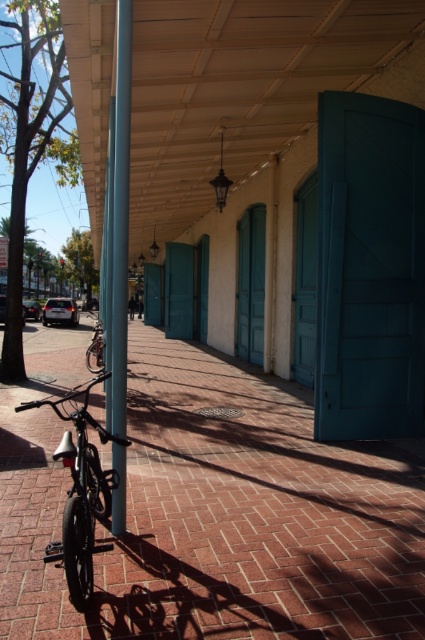
Is brick pavement at center to the right of shiny silver bicycle at center from the viewer's perspective?

Correct, you'll find brick pavement at center to the right of shiny silver bicycle at center.

Is brick pavement at center wider than shiny silver bicycle at center?

Correct, the width of brick pavement at center exceeds that of shiny silver bicycle at center.

Identify the location of brick pavement at center. This screenshot has height=640, width=425. (212, 508).

Can you confirm if metallic silver pole at center is positioned above shiny black bicycle at center?

Indeed, metallic silver pole at center is positioned over shiny black bicycle at center.

Is metallic silver pole at center wider than shiny black bicycle at center?

In fact, metallic silver pole at center might be narrower than shiny black bicycle at center.

This screenshot has width=425, height=640. Describe the element at coordinates (119, 224) in the screenshot. I see `metallic silver pole at center` at that location.

Where is `metallic silver pole at center`? This screenshot has width=425, height=640. metallic silver pole at center is located at coordinates (119, 224).

How much distance is there between shiny black bicycle at center and shiny silver bicycle at center?

A distance of 11.38 meters exists between shiny black bicycle at center and shiny silver bicycle at center.

Can you confirm if shiny black bicycle at center is wider than shiny silver bicycle at center?

No.

Is point (82, 499) positioned after point (96, 355)?

No, it is not.

At what (x,y) coordinates should I click in order to perform the action: click on shiny black bicycle at center. Please return your answer as a coordinate pair (x, y). Looking at the image, I should click on (81, 493).